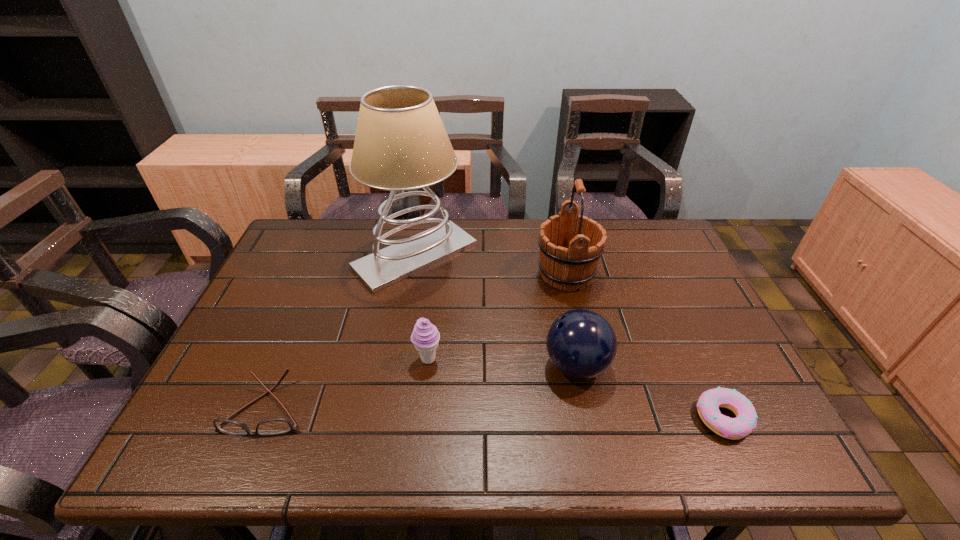
Find the location of a particular element. The width and height of the screenshot is (960, 540). vacant space that is in between the bowling ball and the table lamp is located at coordinates (495, 310).

You are a GUI agent. You are given a task and a screenshot of the screen. Output one action in this format:
    pyautogui.click(x=<x>, y=<y>)
    Task: Click on the unoccupied area between the tallest object and the icecream
    The width and height of the screenshot is (960, 540).
    Given the screenshot: What is the action you would take?
    pyautogui.click(x=421, y=307)

Locate an element on the screen. This screenshot has height=540, width=960. free space between the icecream and the bowling ball is located at coordinates (502, 362).

Where is `free space between the icecream and the doughnut`? This screenshot has width=960, height=540. free space between the icecream and the doughnut is located at coordinates coord(576,388).

Find the location of a particular element. vacant area that lies between the icecream and the spectacles is located at coordinates (348, 383).

This screenshot has height=540, width=960. I want to click on free space between the icecream and the fifth shortest object, so click(x=497, y=316).

Locate an element on the screen. The image size is (960, 540). free area in between the icecream and the fifth shortest object is located at coordinates (497, 316).

Where is `object that is the second closest to the second tallest object`? The width and height of the screenshot is (960, 540). object that is the second closest to the second tallest object is located at coordinates (401, 144).

Select which object is the closest to the table lamp. Please provide its 2D coordinates. Your answer should be formatted as a tuple, i.e. [(x, y)], where the tuple contains the x and y coordinates of a point satisfying the conditions above.

[(570, 246)]

Where is `free space that satisfies the following two spatial constraints: 1. on the surface of the bowling ball near the finger holes; 2. on the front-facing side of the fifth tallest object`? This screenshot has height=540, width=960. free space that satisfies the following two spatial constraints: 1. on the surface of the bowling ball near the finger holes; 2. on the front-facing side of the fifth tallest object is located at coordinates (585, 407).